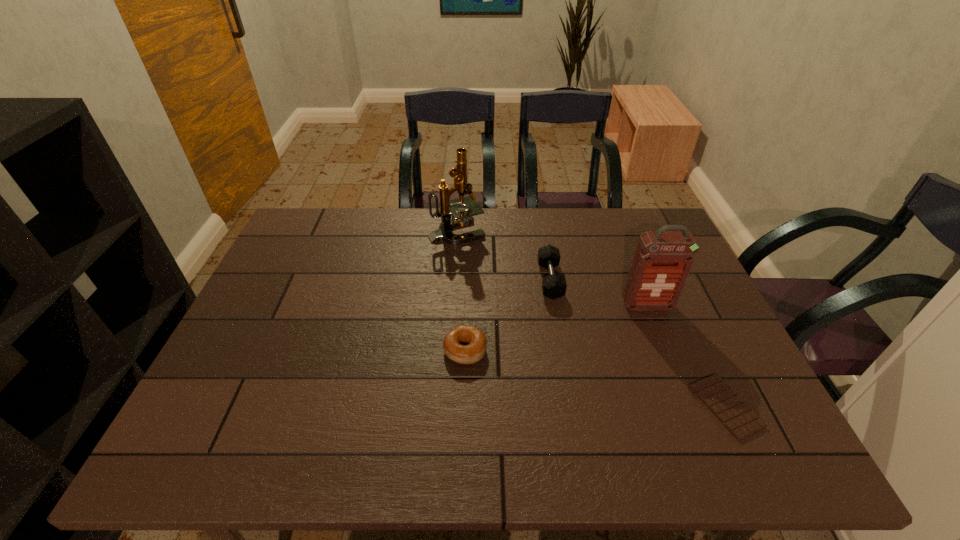
Image resolution: width=960 pixels, height=540 pixels. Find the location of `vacant space at the left edge`. vacant space at the left edge is located at coordinates (275, 303).

At what (x,y) coordinates should I click in order to perform the action: click on vacant space at the near left corner. Please return your answer as a coordinate pair (x, y). Looking at the image, I should click on (259, 434).

You are a GUI agent. You are given a task and a screenshot of the screen. Output one action in this format:
    pyautogui.click(x=<x>, y=<y>)
    Task: Click on the vacant area at the near right corner
    The height and width of the screenshot is (540, 960).
    Given the screenshot: What is the action you would take?
    pyautogui.click(x=774, y=448)

You are a GUI agent. You are given a task and a screenshot of the screen. Output one action in this format:
    pyautogui.click(x=<x>, y=<y>)
    Task: Click on the free space between the shortest object and the fourth tallest object
    The width and height of the screenshot is (960, 540).
    Given the screenshot: What is the action you would take?
    pyautogui.click(x=595, y=379)

This screenshot has width=960, height=540. What are the coordinates of `vacant space that is in between the farthest object and the third shortest object` in the screenshot? It's located at (503, 256).

Locate an element on the screen. The width and height of the screenshot is (960, 540). free area in between the third tallest object and the first-aid kit is located at coordinates (599, 293).

Find the location of a particular element. The image size is (960, 540). vacant area that lies between the fourth tallest object and the shortest object is located at coordinates (595, 379).

The height and width of the screenshot is (540, 960). Identify the location of vacant area between the third shortest object and the second nearest object. (508, 315).

At what (x,y) coordinates should I click in order to perform the action: click on vacant area between the second shortest object and the first-aid kit. Please return your answer as a coordinate pair (x, y). This screenshot has width=960, height=540. Looking at the image, I should click on (556, 328).

Where is `empty space between the first-aid kit and the bagel`? This screenshot has height=540, width=960. empty space between the first-aid kit and the bagel is located at coordinates point(556,328).